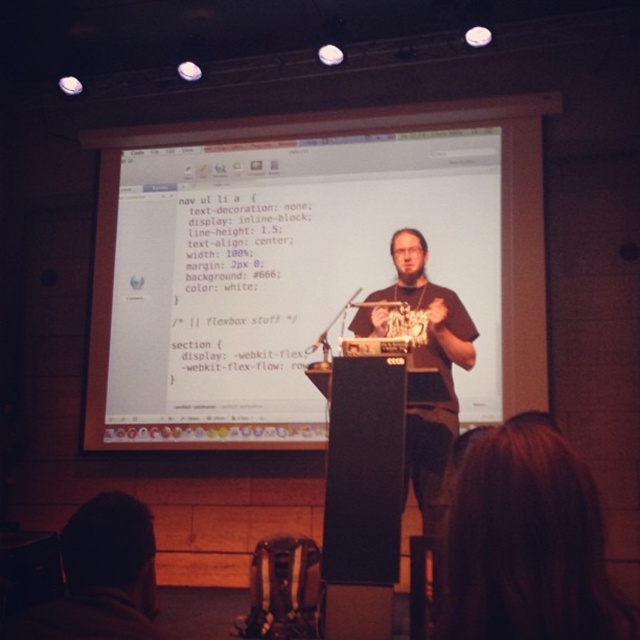
Which of these two, brown hair at upper center or dark brown hair at lower left, stands shorter?

dark brown hair at lower left is shorter.

Between point (525, 477) and point (147, 620), which one is positioned in front?

Point (525, 477) is more forward.

Is point (572, 484) closer to viewer compared to point (51, 612)?

Yes, point (572, 484) is closer to viewer.

The height and width of the screenshot is (640, 640). I want to click on brown hair at upper center, so click(525, 541).

Which is more to the right, white matte screen at center or brown hair at upper center?

brown hair at upper center is more to the right.

Between point (492, 348) and point (474, 445), which one is positioned behind?

Positioned behind is point (492, 348).

Locate an element on the screen. This screenshot has height=640, width=640. white matte screen at center is located at coordinates (300, 262).

This screenshot has width=640, height=640. In order to click on black matte podium at center in this screenshot , I will do `click(364, 472)`.